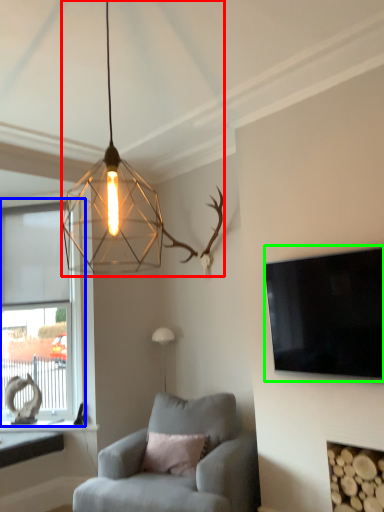
Question: Which is farther away from lamp (highlighted by a red box)? window (highlighted by a blue box) or television (highlighted by a green box)?

Choices:
 (A) window
 (B) television

Answer: (A)